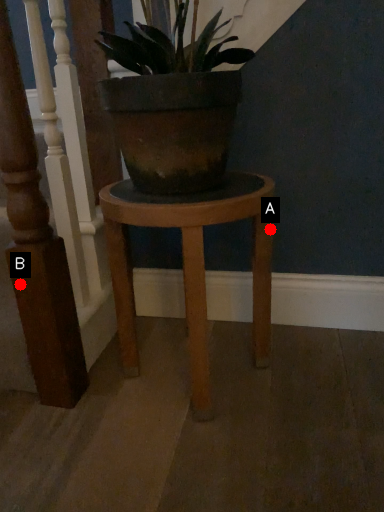
Question: Two points are circled on the image, labeled by A and B beside each circle. Which point is closer to the camera taking this photo?

Choices:
 (A) A is closer
 (B) B is closer

Answer: (B)